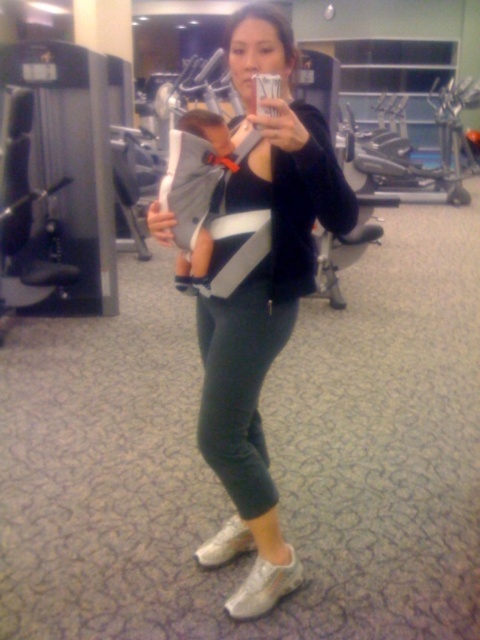
Question: From the image, what is the correct spatial relationship of black matte baby carrier at center in relation to dark green leggings at center?

Choices:
 (A) left
 (B) right

Answer: (B)

Question: Where is black matte baby carrier at center located in relation to dark green leggings at center in the image?

Choices:
 (A) below
 (B) above

Answer: (B)

Question: Considering the relative positions of black matte baby carrier at center and dark green leggings at center in the image provided, where is black matte baby carrier at center located with respect to dark green leggings at center?

Choices:
 (A) above
 (B) below

Answer: (A)

Question: Which object is closer to the camera taking this photo?

Choices:
 (A) black matte baby carrier at center
 (B) dark green leggings at center

Answer: (A)